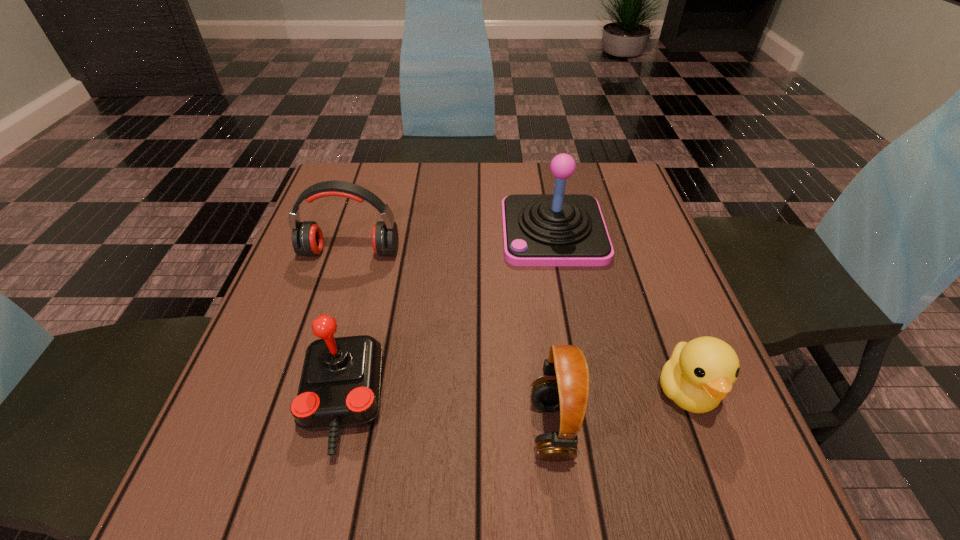
Identify the location of the farther joystick. (558, 229).

At what (x,y) coordinates should I click in order to perform the action: click on the right joystick. Please return your answer as a coordinate pair (x, y). The width and height of the screenshot is (960, 540). Looking at the image, I should click on (558, 229).

This screenshot has width=960, height=540. Identify the location of earphone. (307, 239).

Identify the location of headset. The image size is (960, 540). (564, 386).

This screenshot has width=960, height=540. I want to click on the left joystick, so click(x=339, y=388).

At what (x,y) coordinates should I click in order to perform the action: click on the nearer joystick. Please return your answer as a coordinate pair (x, y). Looking at the image, I should click on (339, 388).

Where is `duck`? Image resolution: width=960 pixels, height=540 pixels. duck is located at coordinates (699, 374).

The height and width of the screenshot is (540, 960). What are the coordinates of `the rightmost object` in the screenshot? It's located at (699, 374).

You are a GUI agent. You are given a task and a screenshot of the screen. Output one action in this format:
    pyautogui.click(x=<x>, y=<y>)
    Task: Click on the free space located 0.150m forward from the base of the farther joystick
    This screenshot has width=960, height=540.
    Given the screenshot: What is the action you would take?
    pyautogui.click(x=441, y=232)

Where is `vacant area situated 0.270m forward from the base of the farther joystick`? The height and width of the screenshot is (540, 960). vacant area situated 0.270m forward from the base of the farther joystick is located at coordinates (391, 232).